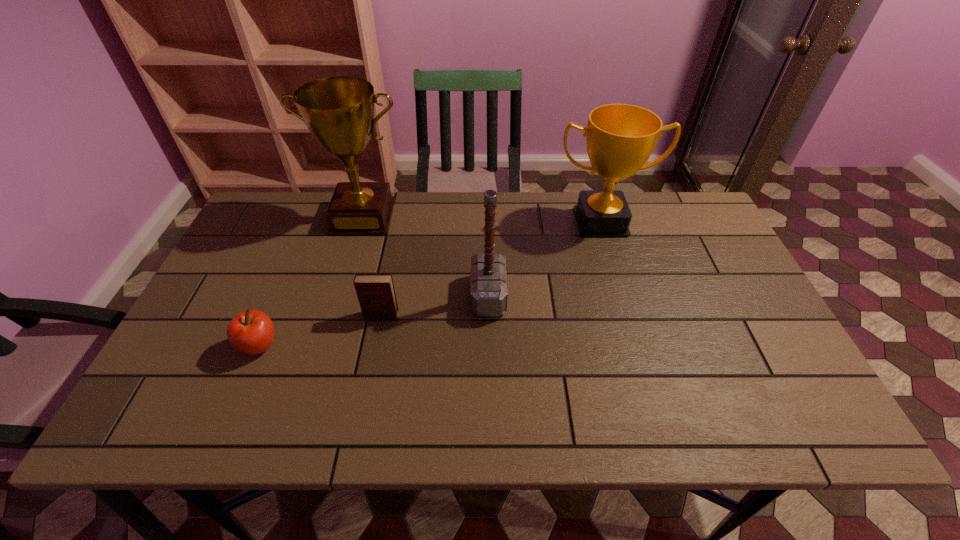
Identify the location of blank space at the far right corner of the desktop. (709, 221).

Identify the location of free area in between the apple and the rightmost object. (430, 284).

This screenshot has height=540, width=960. I want to click on unoccupied area between the taller award and the shorter award, so click(482, 219).

The width and height of the screenshot is (960, 540). Identify the location of free space that is in between the second object from right to left and the tallest object. pyautogui.click(x=425, y=256).

The width and height of the screenshot is (960, 540). Find the location of `free area in between the right award and the left award`. free area in between the right award and the left award is located at coordinates (482, 219).

You are a GUI agent. You are given a task and a screenshot of the screen. Output one action in this format:
    pyautogui.click(x=<x>, y=<y>)
    Task: Click on the vacant point located between the diary and the tallest object
    
    Given the screenshot: What is the action you would take?
    pyautogui.click(x=372, y=266)

Locate an element on the screen. The image size is (960, 540). vacant area that lies between the hammer and the rightmost object is located at coordinates (544, 259).

Where is `free area in between the fourth object from left to right and the shorter award`? This screenshot has width=960, height=540. free area in between the fourth object from left to right and the shorter award is located at coordinates (544, 259).

This screenshot has height=540, width=960. Find the location of `vacant area that lies between the second object from right to left and the nearest object`. vacant area that lies between the second object from right to left and the nearest object is located at coordinates (374, 321).

Locate an element on the screen. unoccupied area between the right award and the left award is located at coordinates (482, 219).